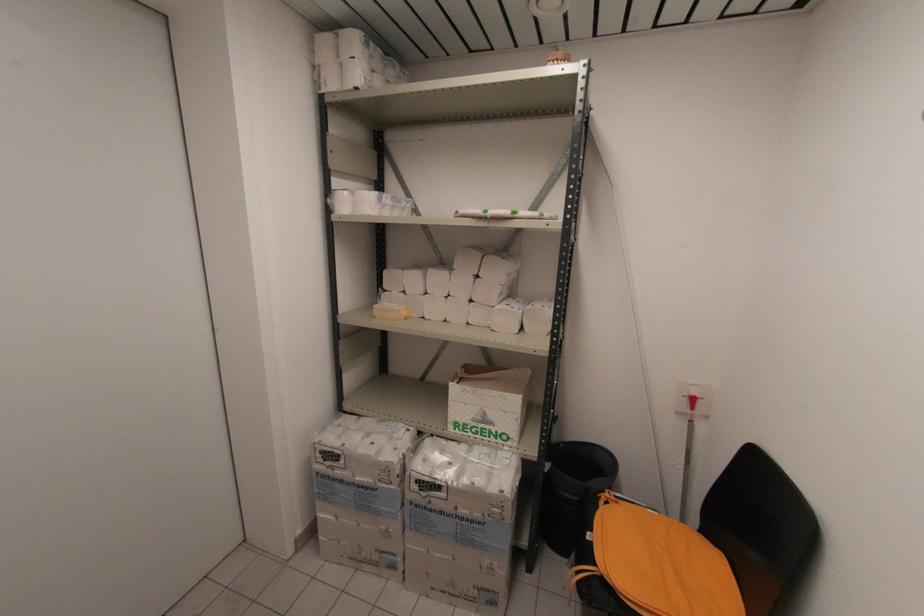
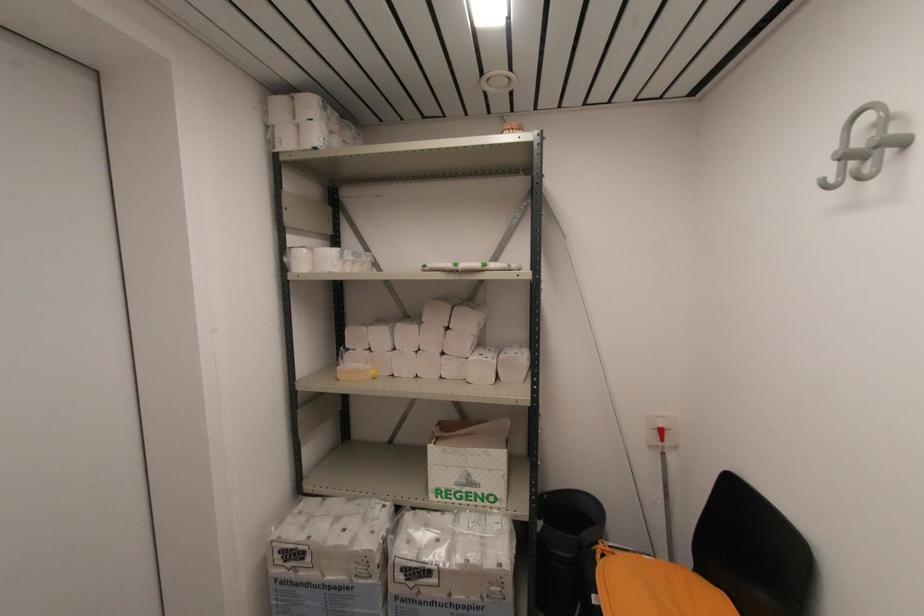
Locate, in the second image, the point that corresponds to point (546, 471) in the first image.

(540, 530)